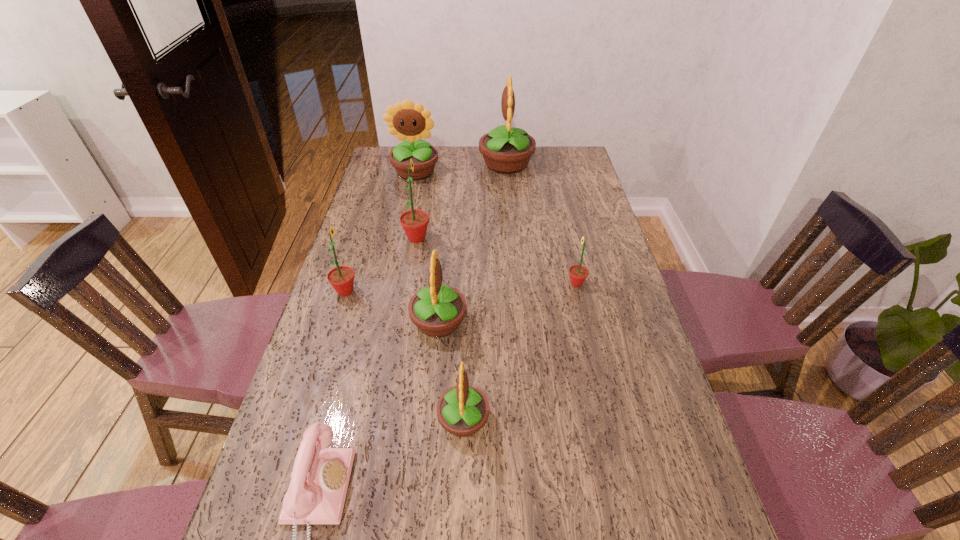
Where is `the rightmost green sunflower`? the rightmost green sunflower is located at coordinates (578, 273).

Identify the location of the smallest green sunflower. The width and height of the screenshot is (960, 540). (578, 273).

Locate an element on the screen. The image size is (960, 540). vacant position located 0.390m on the face of the biggest yellow sunflower is located at coordinates (388, 163).

The image size is (960, 540). Identify the location of free space located on the face of the biggest yellow sunflower. (465, 163).

Where is `vacant area situated 0.090m on the face of the biggest yellow sunflower`? This screenshot has height=540, width=960. vacant area situated 0.090m on the face of the biggest yellow sunflower is located at coordinates (458, 163).

Locate an element on the screen. The width and height of the screenshot is (960, 540). free space located on the face of the second biggest yellow sunflower is located at coordinates (411, 193).

Identify the location of vacant space located 0.080m on the face of the third farthest object. (454, 238).

The height and width of the screenshot is (540, 960). What are the coordinates of `vacant space located on the face of the third farthest yellow sunflower` in the screenshot? It's located at (485, 322).

The width and height of the screenshot is (960, 540). Identify the location of free spot located on the face of the leftmost green sunflower. (402, 291).

Identify the location of free space located 0.240m on the face of the nearest sunflower. Image resolution: width=960 pixels, height=540 pixels. (593, 420).